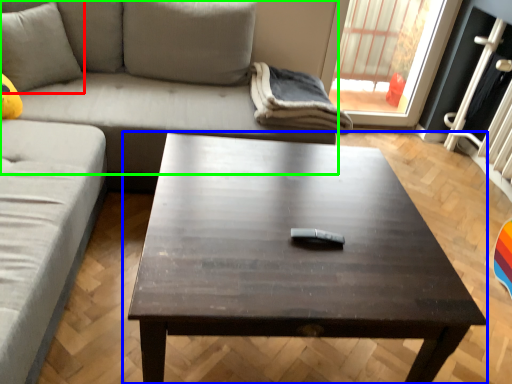
Question: Which object is positioned farthest from pillow (highlighted by a red box)? Select from coffee table (highlighted by a blue box) and studio couch (highlighted by a green box).

Choices:
 (A) coffee table
 (B) studio couch

Answer: (A)